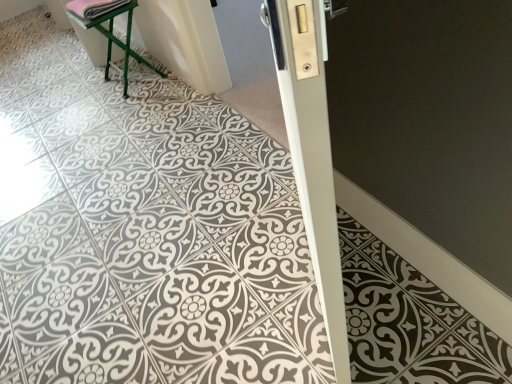
Question: Does white glossy door at center have a lesser width compared to green metal stool at upper left?

Choices:
 (A) no
 (B) yes

Answer: (B)

Question: Is green metal stool at upper left located within white glossy door at center?

Choices:
 (A) yes
 (B) no

Answer: (B)

Question: Can you confirm if white glossy door at center is shorter than green metal stool at upper left?

Choices:
 (A) yes
 (B) no

Answer: (B)

Question: From the image's perspective, is white glossy door at center above green metal stool at upper left?

Choices:
 (A) no
 (B) yes

Answer: (A)

Question: Is white glossy door at center completely or partially outside of green metal stool at upper left?

Choices:
 (A) no
 (B) yes

Answer: (B)

Question: From the image's perspective, is white glossy door at center below green metal stool at upper left?

Choices:
 (A) no
 (B) yes

Answer: (B)

Question: Can you confirm if green metal stool at upper left is positioned to the right of white glossy door at center?

Choices:
 (A) yes
 (B) no

Answer: (B)

Question: Is green metal stool at upper left turned away from white glossy door at center?

Choices:
 (A) yes
 (B) no

Answer: (B)

Question: Is green metal stool at upper left at the left side of white glossy door at center?

Choices:
 (A) yes
 (B) no

Answer: (A)

Question: Is green metal stool at upper left smaller than white glossy door at center?

Choices:
 (A) yes
 (B) no

Answer: (A)

Question: Is green metal stool at upper left facing towards white glossy door at center?

Choices:
 (A) yes
 (B) no

Answer: (B)

Question: Is green metal stool at upper left wider than white glossy door at center?

Choices:
 (A) yes
 (B) no

Answer: (A)

Question: Does pink fabric at upper left have a smaller size compared to white glossy door at center?

Choices:
 (A) yes
 (B) no

Answer: (A)